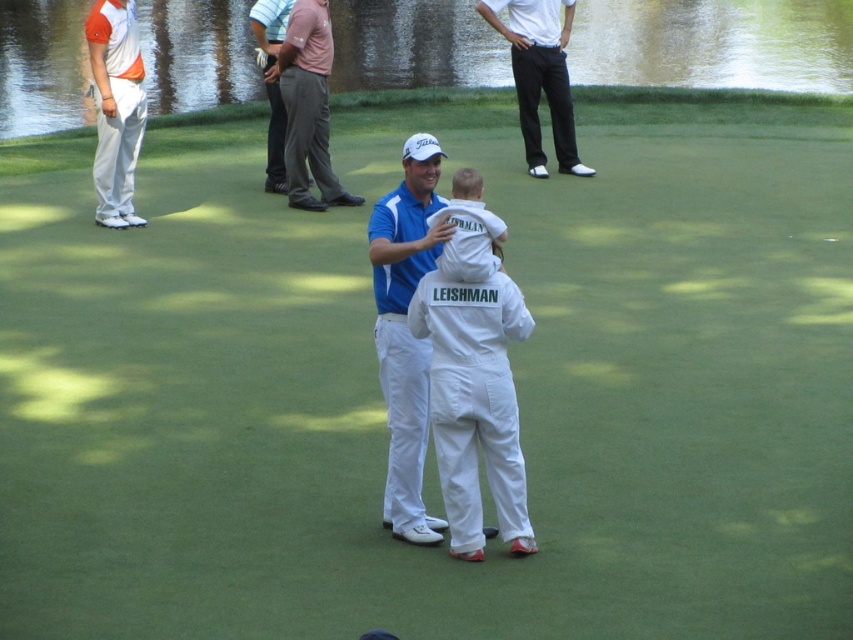
Question: Which of the following is the farthest from the observer?

Choices:
 (A) (352, 204)
 (B) (432, 348)
 (C) (538, 35)
 (D) (396, 364)

Answer: (C)

Question: Does orange and white striped polo shirt at upper left appear on the left side of smooth pink polo shirt at upper center?

Choices:
 (A) yes
 (B) no

Answer: (A)

Question: Which of the following is the farthest from the observer?

Choices:
 (A) (122, 180)
 (B) (549, 19)

Answer: (B)

Question: Which object appears closest to the camera in this image?

Choices:
 (A) pink fabric pants at upper center
 (B) dark gray pants at upper center

Answer: (A)

Question: Does white matte jumpsuit at center have a larger size compared to pink fabric pants at upper center?

Choices:
 (A) yes
 (B) no

Answer: (B)

Question: Where is white matte jumpsuit at center located in relation to orange and white striped polo shirt at upper left in the image?

Choices:
 (A) below
 (B) above

Answer: (A)